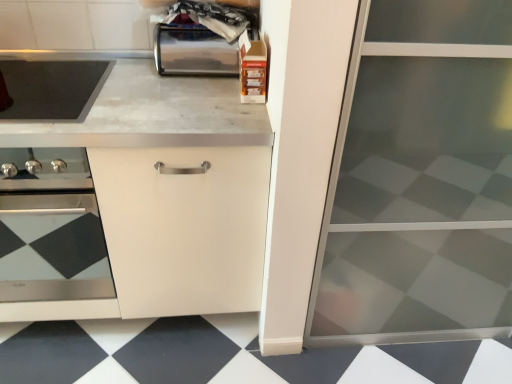
Question: Is black glossy tile at lower center at the left side of shiny metallic toaster at upper center?

Choices:
 (A) no
 (B) yes

Answer: (A)

Question: Considering the relative positions of black glossy tile at lower center and shiny metallic toaster at upper center in the image provided, is black glossy tile at lower center in front of shiny metallic toaster at upper center?

Choices:
 (A) no
 (B) yes

Answer: (B)

Question: Is black glossy tile at lower center positioned with its back to shiny metallic toaster at upper center?

Choices:
 (A) yes
 (B) no

Answer: (B)

Question: Does black glossy tile at lower center have a lesser height compared to shiny metallic toaster at upper center?

Choices:
 (A) no
 (B) yes

Answer: (B)

Question: From a real-world perspective, does black glossy tile at lower center stand above shiny metallic toaster at upper center?

Choices:
 (A) yes
 (B) no

Answer: (B)

Question: From a real-world perspective, is black glossy tile at lower center physically below shiny metallic toaster at upper center?

Choices:
 (A) no
 (B) yes

Answer: (B)

Question: Can you confirm if transparent glass screen door at right is positioned to the right of matte black oven at left?

Choices:
 (A) no
 (B) yes

Answer: (B)

Question: Does transparent glass screen door at right have a greater width compared to matte black oven at left?

Choices:
 (A) yes
 (B) no

Answer: (A)

Question: Is transparent glass screen door at right at the left side of matte black oven at left?

Choices:
 (A) yes
 (B) no

Answer: (B)

Question: Considering the relative sizes of transparent glass screen door at right and matte black oven at left in the image provided, is transparent glass screen door at right bigger than matte black oven at left?

Choices:
 (A) no
 (B) yes

Answer: (B)

Question: Is transparent glass screen door at right turned away from matte black oven at left?

Choices:
 (A) no
 (B) yes

Answer: (A)

Question: From the image's perspective, is transparent glass screen door at right below matte black oven at left?

Choices:
 (A) no
 (B) yes

Answer: (A)

Question: Is shiny metallic toaster at upper center facing away from black glossy tile at lower center?

Choices:
 (A) no
 (B) yes

Answer: (A)